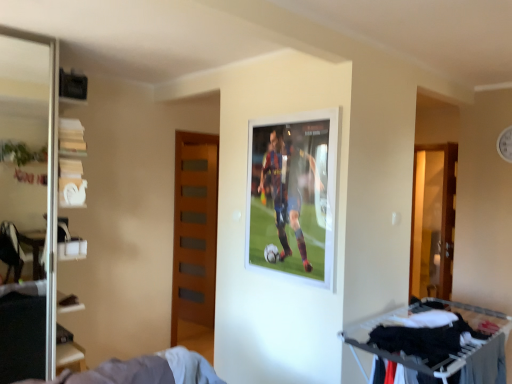
You are a GUI agent. You are given a task and a screenshot of the screen. Output one action in this format:
    pyautogui.click(x=<x>, y=<y>)
    Task: Click on the white plastic shelves at left
    This screenshot has height=384, width=512.
    Given the screenshot: What is the action you would take?
    pyautogui.click(x=71, y=164)

Measure the distance between point (172,339) and camera.

12.88 feet.

The image size is (512, 384). Describe the element at coordinates (194, 235) in the screenshot. I see `wooden door at center-left` at that location.

Find the location of a particular element. The height and width of the screenshot is (384, 512). white fabric clothes rack at lower right is located at coordinates (436, 343).

From a real-world perspective, which object stands above the other?

From a 3D spatial view, white plastic shelves at left is above.

How many degrees apart are the facing directions of white fabric clothes rack at lower right and white plastic shelves at left?

There is a 88.6-degree angle between the facing directions of white fabric clothes rack at lower right and white plastic shelves at left.

Does point (426, 328) appear closer or farther from the camera than point (79, 354)?

Point (426, 328) is positioned closer to the camera compared to point (79, 354).

Consider the image. Between white fabric clothes rack at lower right and white plastic shelves at left, which one has more height?

Standing taller between the two is white plastic shelves at left.

Is white fabric clothes rack at lower right completely or partially outside of transparent glass screen door at left?

Absolutely, white fabric clothes rack at lower right is external to transparent glass screen door at left.

Is white fabric clothes rack at lower right facing away from transparent glass screen door at left?

That's not correct — white fabric clothes rack at lower right is not looking away from transparent glass screen door at left.

From a real-world perspective, who is located higher, white fabric clothes rack at lower right or transparent glass screen door at left?

transparent glass screen door at left.

Which of these two, white plastic shelves at left or transparent glass screen door at left, is wider?

Wider between the two is white plastic shelves at left.

Is white plastic shelves at left shorter than transparent glass screen door at left?

Correct, white plastic shelves at left is not as tall as transparent glass screen door at left.

Who is more distant, white plastic shelves at left or transparent glass screen door at left?

white plastic shelves at left.

Which of these two, white plastic shelves at left or transparent glass screen door at left, is bigger?

With larger size is white plastic shelves at left.

From a real-world perspective, is transparent glass screen door at left positioned above or below wooden door at center-left?

Clearly, from a real-world perspective, transparent glass screen door at left is above wooden door at center-left.

Between point (15, 142) and point (180, 307), which one is positioned behind?

The point (180, 307) is more distant.

Where is `screen door in front of the wooden door at center-left`? Image resolution: width=512 pixels, height=384 pixels. screen door in front of the wooden door at center-left is located at coordinates [27, 203].

Which is correct: wooden door at center-left is inside white plastic shelves at left, or outside of it?

wooden door at center-left is not enclosed by white plastic shelves at left.

Could you tell me if wooden door at center-left is turned towards white plastic shelves at left?

No, wooden door at center-left does not turn towards white plastic shelves at left.

From a real-world perspective, is wooden door at center-left physically located above or below white plastic shelves at left?

From a real-world perspective, wooden door at center-left is physically below white plastic shelves at left.

You are a GUI agent. You are given a task and a screenshot of the screen. Output one action in this format:
    pyautogui.click(x=<x>, y=<y>)
    Task: Click on the bookshelf below the transparent glass screen door at left (from the image's perspective)
    The height and width of the screenshot is (384, 512).
    Given the screenshot: What is the action you would take?
    pyautogui.click(x=71, y=164)

Is transparent glass screen door at left bigger or smaller than white plastic shelves at left?

transparent glass screen door at left is smaller than white plastic shelves at left.

Is transparent glass screen door at left in front of or behind white plastic shelves at left in the image?

In the image, transparent glass screen door at left appears in front of white plastic shelves at left.

Is white fabric clothes rack at lower right positioned before wooden door at center-left?

Yes, it is.

Is white fabric clothes rack at lower right aimed at wooden door at center-left?

No, white fabric clothes rack at lower right is not turned towards wooden door at center-left.

Which is farther, (502,345) or (176,185)?

The point (176,185) is farther from the camera.

Locate an element on the screen. The image size is (512, 384). bookshelf that is above the white fabric clothes rack at lower right (from a real-world perspective) is located at coordinates [71, 164].

At what (x,y) coordinates should I click in order to perform the action: click on screen door that is above the white fabric clothes rack at lower right (from the image's perspective). Please return your answer as a coordinate pair (x, y). Looking at the image, I should click on (27, 203).

Based on their spatial positions, is transparent glass screen door at left or white plastic shelves at left closer to white fabric clothes rack at lower right?

white plastic shelves at left is closer to white fabric clothes rack at lower right.

Which object lies further to the anchor point wooden door at center-left, transparent glass screen door at left or white fabric clothes rack at lower right?

Based on the image, white fabric clothes rack at lower right appears to be further to wooden door at center-left.

From the image, which object appears to be nearer to white plastic shelves at left, white fabric clothes rack at lower right or transparent glass screen door at left?

transparent glass screen door at left.

Considering their positions, is white plastic shelves at left positioned closer to transparent glass screen door at left than white fabric clothes rack at lower right?

The object closer to transparent glass screen door at left is white plastic shelves at left.

Which object lies further to the anchor point white plastic shelves at left, transparent glass screen door at left or white fabric clothes rack at lower right?

white fabric clothes rack at lower right is positioned further to the anchor white plastic shelves at left.

Estimate the real-world distances between objects in this image. Which object is closer to white plastic shelves at left, transparent glass screen door at left or wooden door at center-left?

transparent glass screen door at left lies closer to white plastic shelves at left than the other object.

Looking at the image, which one is located further to transparent glass screen door at left, white plastic shelves at left or wooden door at center-left?

wooden door at center-left lies further to transparent glass screen door at left than the other object.

Considering their positions, is transparent glass screen door at left positioned closer to wooden door at center-left than white plastic shelves at left?

The object closer to wooden door at center-left is transparent glass screen door at left.

In order to click on screen door between white fabric clothes rack at lower right and wooden door at center-left in the front-back direction in this screenshot , I will do `click(27, 203)`.

Where is `screen door between white plastic shelves at left and white fabric clothes rack at lower right in the horizontal direction`? This screenshot has width=512, height=384. screen door between white plastic shelves at left and white fabric clothes rack at lower right in the horizontal direction is located at coordinates (27, 203).

Locate an element on the screen. Image resolution: width=512 pixels, height=384 pixels. bookshelf between white fabric clothes rack at lower right and wooden door at center-left in the front-back direction is located at coordinates (71, 164).

This screenshot has height=384, width=512. Identify the location of bookshelf between transparent glass screen door at left and wooden door at center-left from front to back. (71, 164).